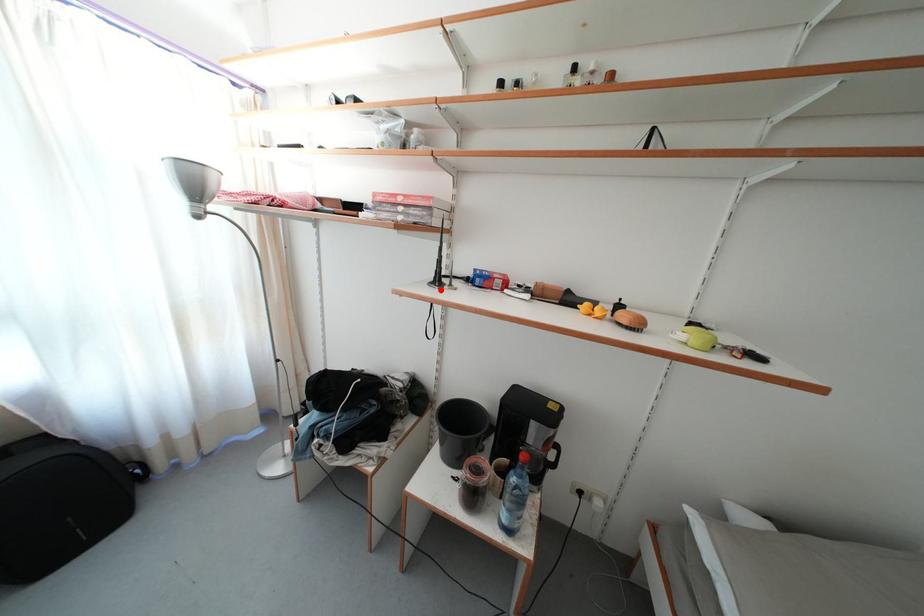
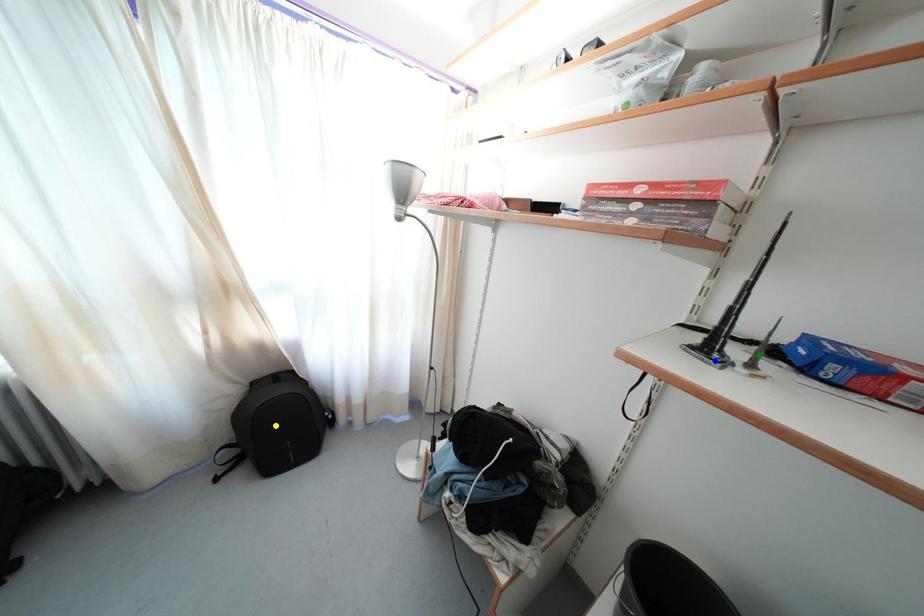
Question: I am providing you with two images of the same scene from different viewpoints. A red point is marked on the first image. You are given multiple points on the second image. Which mark in image 2 goes with the point in image 1?

Choices:
 (A) blue point
 (B) yellow point
 (C) green point

Answer: (A)